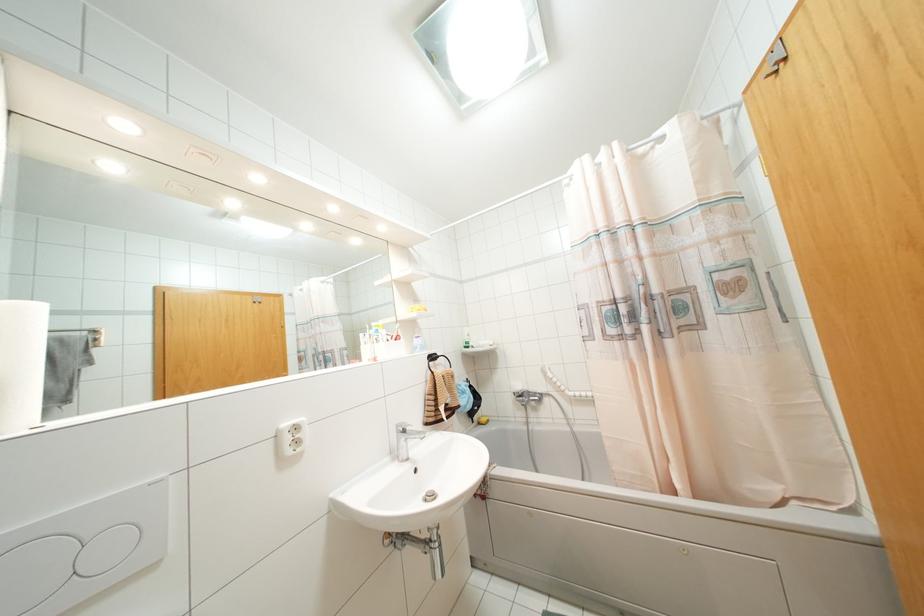
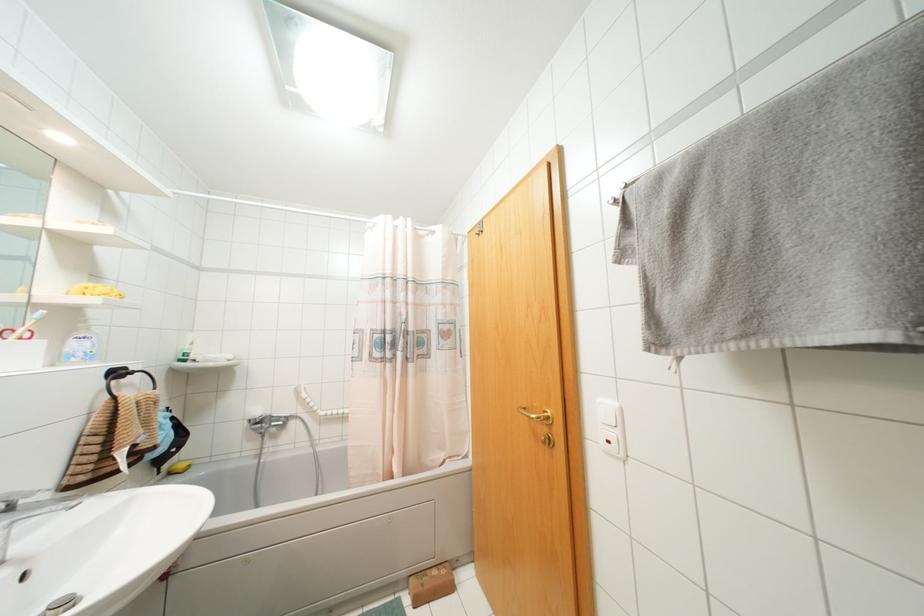
Where in the second image is the point corresponding to (x=397, y=323) from the first image?

(42, 310)